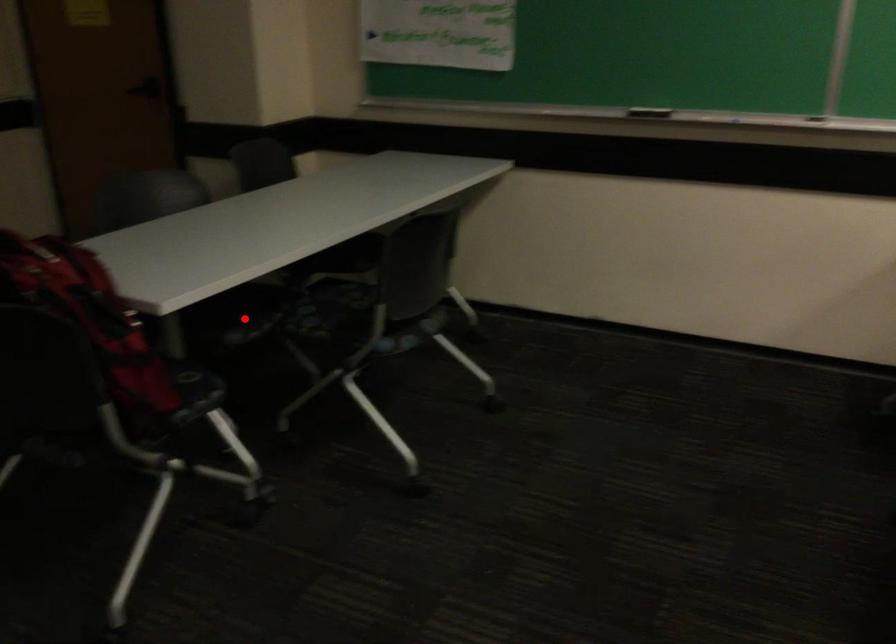
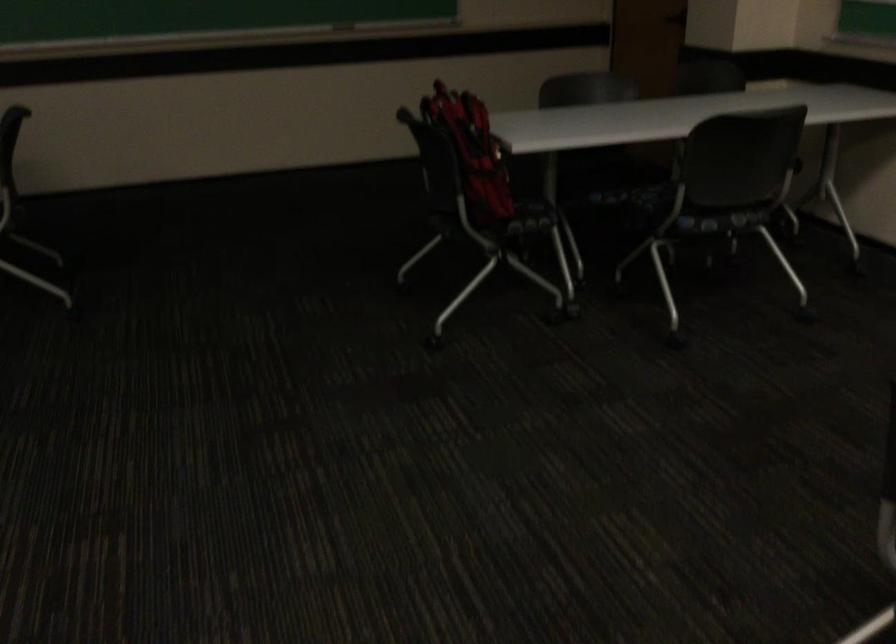
Question: I am providing you with two images of the same scene from different viewpoints. A red point is shown in image1. For the corresponding object point in image2, is it positioned nearer or farther from the camera?

Choices:
 (A) Nearer
 (B) Farther

Answer: (B)